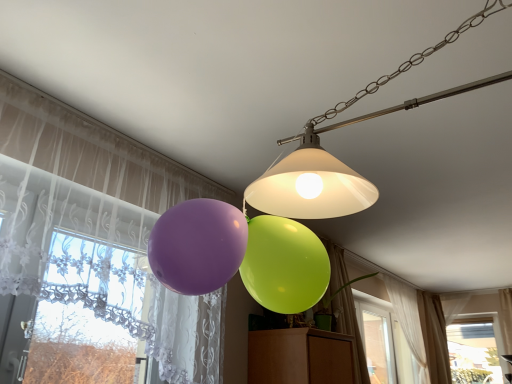
Question: Can you confirm if green fabric curtain at lower right, arranged as the second curtain when viewed from the front, is taller than translucent fabric curtain at left, the 1th curtain from the left?

Choices:
 (A) no
 (B) yes

Answer: (A)

Question: Is green fabric curtain at lower right, arranged as the second curtain when viewed from the front, behind translucent fabric curtain at left, the 1th curtain from the front?

Choices:
 (A) no
 (B) yes

Answer: (B)

Question: Does green fabric curtain at lower right, arranged as the second curtain when viewed from the front, have a lesser height compared to translucent fabric curtain at left, which is the fourth curtain in right-to-left order?

Choices:
 (A) yes
 (B) no

Answer: (A)

Question: Does green fabric curtain at lower right, acting as the 2th curtain starting from the left, turn towards translucent fabric curtain at left, which is the fourth curtain in right-to-left order?

Choices:
 (A) no
 (B) yes

Answer: (A)

Question: Is the position of green fabric curtain at lower right, acting as the third curtain starting from the right, less distant than that of translucent fabric curtain at left, the 1th curtain from the front?

Choices:
 (A) yes
 (B) no

Answer: (B)

Question: Looking at their shapes, would you say beige sheer curtain at lower right, the fourth curtain viewed from the front, is wider or thinner than matte white lampshade at upper center?

Choices:
 (A) thin
 (B) wide

Answer: (A)

Question: Is beige sheer curtain at lower right, the 1th curtain viewed from the right, taller or shorter than matte white lampshade at upper center?

Choices:
 (A) short
 (B) tall

Answer: (B)

Question: Relative to matte white lampshade at upper center, is beige sheer curtain at lower right, positioned as the fourth curtain in left-to-right order, in front or behind?

Choices:
 (A) front
 (B) behind

Answer: (B)

Question: Do you think beige sheer curtain at lower right, the 1th curtain viewed from the right, is within matte white lampshade at upper center, or outside of it?

Choices:
 (A) outside
 (B) inside

Answer: (A)

Question: Is point (452, 334) positioned closer to the camera than point (33, 160)?

Choices:
 (A) closer
 (B) farther

Answer: (B)

Question: From the image's perspective, is transparent glass window at lower right positioned above or below translucent fabric curtain at left, the 4th curtain when ordered from back to front?

Choices:
 (A) below
 (B) above

Answer: (A)

Question: Is transparent glass window at lower right inside or outside of translucent fabric curtain at left, the 1th curtain from the front?

Choices:
 (A) outside
 (B) inside

Answer: (A)

Question: Considering the relative positions of transparent glass window at lower right and translucent fabric curtain at left, which is the fourth curtain in right-to-left order, in the image provided, is transparent glass window at lower right to the left or to the right of translucent fabric curtain at left, which is the fourth curtain in right-to-left order,?

Choices:
 (A) left
 (B) right

Answer: (B)

Question: From the image's perspective, relative to transparent glass window at lower right, is beige sheer curtain at lower right, the fourth curtain viewed from the front, above or below?

Choices:
 (A) below
 (B) above

Answer: (B)

Question: From a real-world perspective, is beige sheer curtain at lower right, positioned as the fourth curtain in left-to-right order, physically located above or below transparent glass window at lower right?

Choices:
 (A) above
 (B) below

Answer: (A)